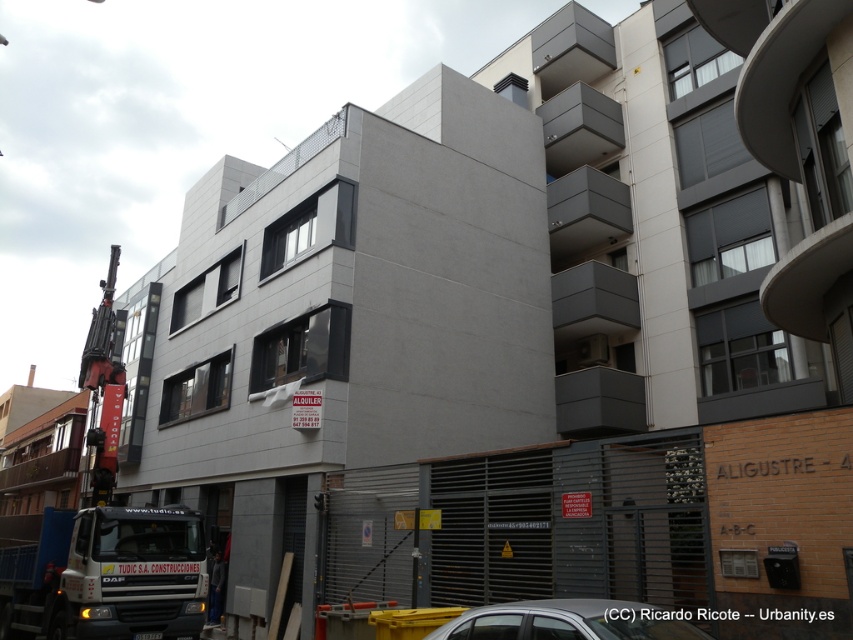
Question: Is metallic silver car at lower center closer to the viewer compared to metallic red crane at left?

Choices:
 (A) no
 (B) yes

Answer: (B)

Question: Observing the image, what is the correct spatial positioning of metallic silver car at lower center in reference to metallic red crane at left?

Choices:
 (A) right
 (B) left

Answer: (A)

Question: Is metallic silver car at lower center smaller than metallic red crane at left?

Choices:
 (A) yes
 (B) no

Answer: (A)